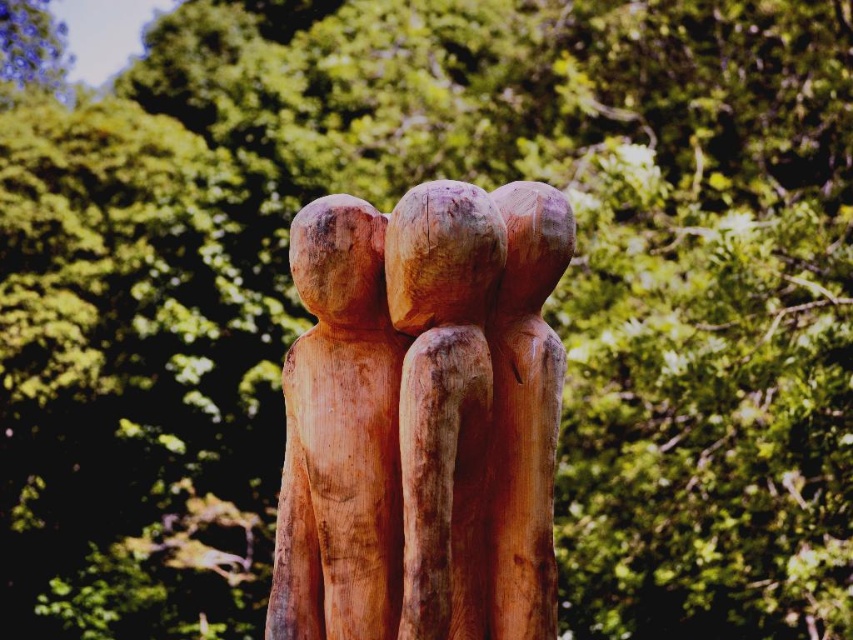
Question: Which of the following is the closest to the observer?

Choices:
 (A) (383, 589)
 (B) (450, 300)

Answer: (B)

Question: Is natural wood sculpture at center positioned behind natural wood figure at center?

Choices:
 (A) yes
 (B) no

Answer: (B)

Question: Can you confirm if natural wood sculpture at center is positioned to the left of natural wood figure at center?

Choices:
 (A) no
 (B) yes

Answer: (A)

Question: Can you confirm if natural wood sculpture at center is wider than natural wood figure at center?

Choices:
 (A) no
 (B) yes

Answer: (B)

Question: Which point is farther to the camera?

Choices:
 (A) natural wood sculpture at center
 (B) natural wood figure at center

Answer: (B)